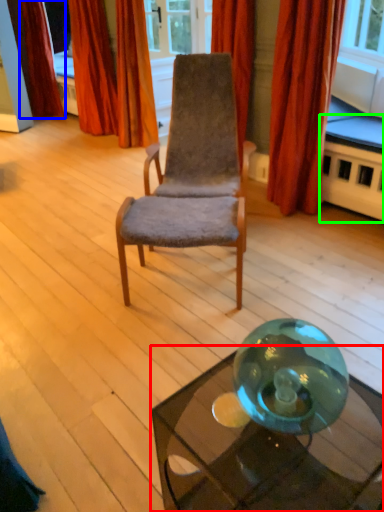
Question: Considering the real-world distances, which object is farthest from table (highlighted by a red box)? curtain (highlighted by a blue box) or table (highlighted by a green box)?

Choices:
 (A) curtain
 (B) table

Answer: (A)